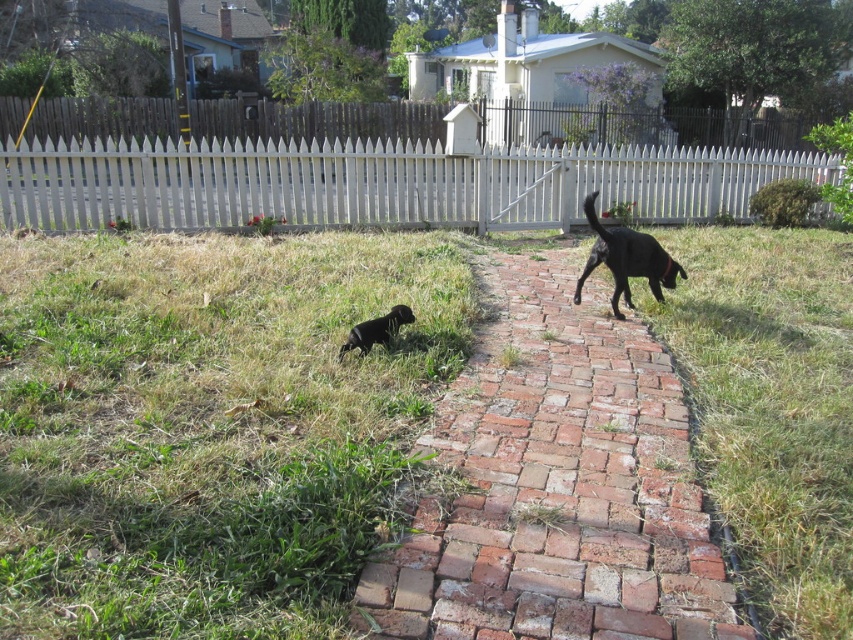
Question: Which of the following is the closest to the observer?

Choices:
 (A) (575, 605)
 (B) (360, 355)
 (C) (648, 259)

Answer: (A)

Question: Among these points, which one is farthest from the camera?

Choices:
 (A) (619, 448)
 (B) (622, 248)
 (C) (706, 170)

Answer: (C)

Question: Is white picket fence at upper center above shiny black dog at right?

Choices:
 (A) no
 (B) yes

Answer: (B)

Question: Is green grass at lower left positioned before black matte dog at center?

Choices:
 (A) yes
 (B) no

Answer: (A)

Question: Observing the image, what is the correct spatial positioning of white picket fence at upper center in reference to shiny black dog at right?

Choices:
 (A) left
 (B) right

Answer: (B)

Question: Which point appears closest to the camera in this image?

Choices:
 (A) (393, 307)
 (B) (209, 444)

Answer: (B)